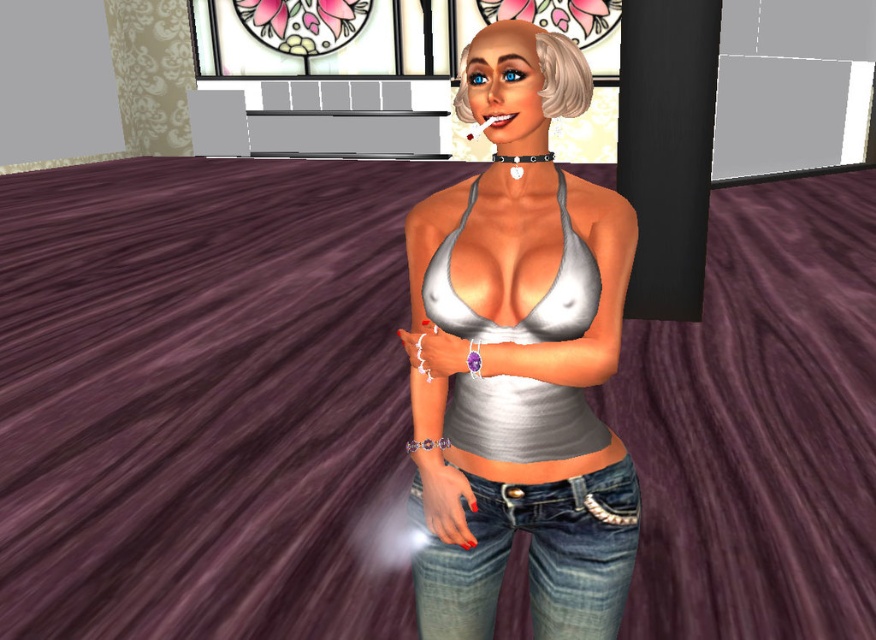
You are standing in a room with a purple carpeted floor and a window with floral designs. There is a point marked at coordinates (471, 589). If you want to place a small potted plant exactly 2 meters away from that point, will you be able to do so while staying within the room?

The distance between the point (471, 589) and the viewer is 1.56 meters. Since you need to place the plant 2 meters away from the point, you would have to move 2 meters away from it. However, since you are only 1.56 meters away from the point yourself, you cannot reach the required distance while staying within the room.

Based on the scene description, where is the denim jeans at center located in relation to the white matte bikini top at center?

The denim jeans at center is to the right of the white matte bikini top at center.